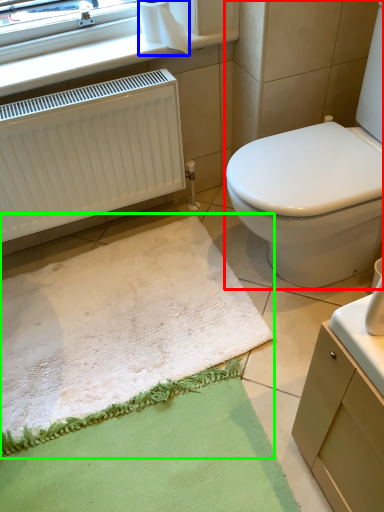
Question: Which is farther away from toilet (highlighted by a red box)? toilet paper (highlighted by a blue box) or bath mat (highlighted by a green box)?

Choices:
 (A) toilet paper
 (B) bath mat

Answer: (A)